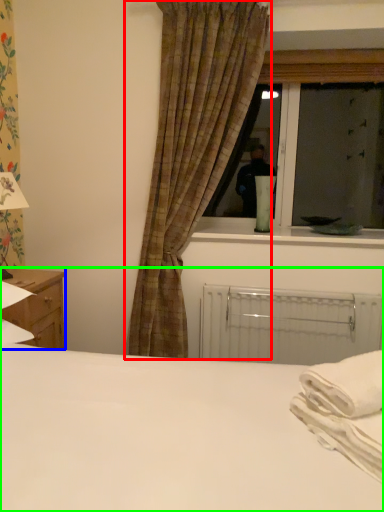
Question: Estimate the real-world distances between objects in this image. Which object is closer to curtain (highlighted by a red box), nightstand (highlighted by a blue box) or bed (highlighted by a green box)?

Choices:
 (A) nightstand
 (B) bed

Answer: (A)